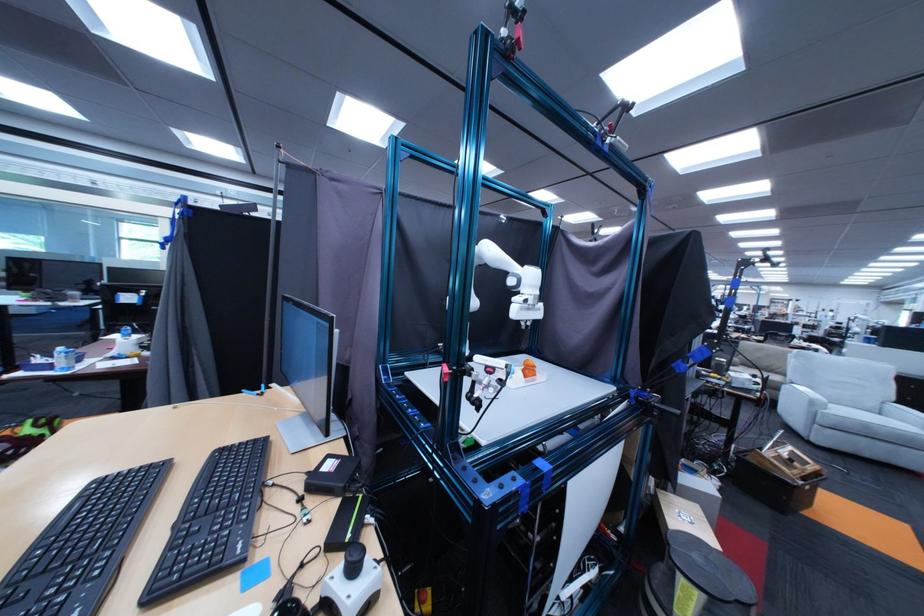
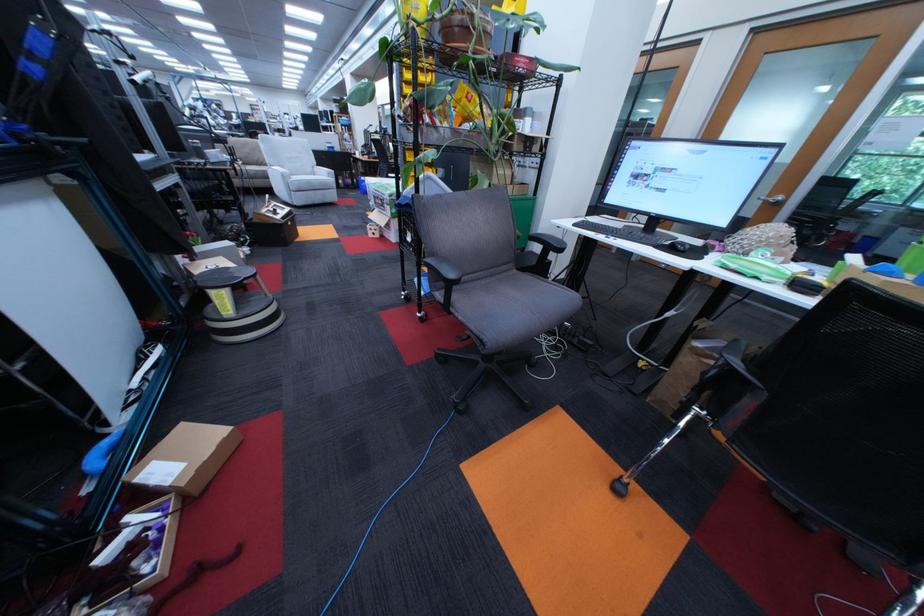
Where in the second image is the point corresponding to (x=696, y=581) from the first image?

(225, 294)